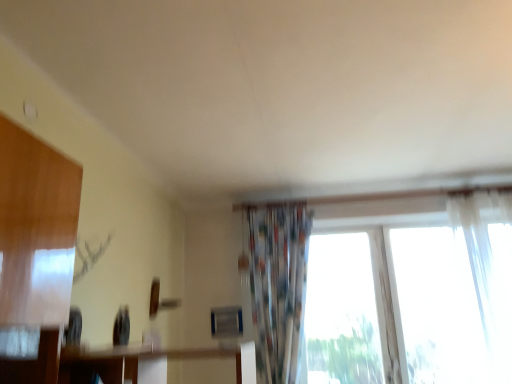
Question: Can we say white sheer curtain at right, which is the second curtain in left-to-right order, lies outside printed fabric curtain at center, which appears as the second curtain when viewed from the right?

Choices:
 (A) yes
 (B) no

Answer: (A)

Question: From the image's perspective, is white sheer curtain at right, which is the second curtain in left-to-right order, located beneath printed fabric curtain at center, which appears as the second curtain when viewed from the right?

Choices:
 (A) no
 (B) yes

Answer: (A)

Question: Is white sheer curtain at right, which is the second curtain in left-to-right order, surrounding printed fabric curtain at center, which appears as the first curtain when viewed from the left?

Choices:
 (A) yes
 (B) no

Answer: (B)

Question: Is white sheer curtain at right, which is the second curtain in left-to-right order, further to camera compared to printed fabric curtain at center, which appears as the second curtain when viewed from the right?

Choices:
 (A) no
 (B) yes

Answer: (A)

Question: From a real-world perspective, is white sheer curtain at right, which is the second curtain in left-to-right order, under printed fabric curtain at center, which appears as the first curtain when viewed from the left?

Choices:
 (A) yes
 (B) no

Answer: (A)

Question: Looking at their shapes, would you say printed fabric curtain at center, which appears as the first curtain when viewed from the left, is wider or thinner than transparent fabric at right?

Choices:
 (A) wide
 (B) thin

Answer: (A)

Question: Considering the relative positions of printed fabric curtain at center, which appears as the second curtain when viewed from the right, and transparent fabric at right in the image provided, is printed fabric curtain at center, which appears as the second curtain when viewed from the right, to the left or to the right of transparent fabric at right?

Choices:
 (A) left
 (B) right

Answer: (A)

Question: From their relative heights in the image, would you say printed fabric curtain at center, which appears as the first curtain when viewed from the left, is taller or shorter than transparent fabric at right?

Choices:
 (A) tall
 (B) short

Answer: (A)

Question: Relative to transparent fabric at right, is printed fabric curtain at center, which appears as the second curtain when viewed from the right, in front or behind?

Choices:
 (A) behind
 (B) front

Answer: (B)

Question: Is printed fabric curtain at center, which appears as the second curtain when viewed from the right, wider or thinner than white sheer curtain at right, placed as the first curtain when sorted from right to left?

Choices:
 (A) thin
 (B) wide

Answer: (B)

Question: Is point (272, 251) closer or farther from the camera than point (501, 375)?

Choices:
 (A) farther
 (B) closer

Answer: (A)

Question: In terms of height, does printed fabric curtain at center, which appears as the first curtain when viewed from the left, look taller or shorter compared to white sheer curtain at right, which is the second curtain in left-to-right order?

Choices:
 (A) short
 (B) tall

Answer: (A)

Question: Based on their positions, is printed fabric curtain at center, which appears as the first curtain when viewed from the left, located to the left or right of white sheer curtain at right, which is the second curtain in left-to-right order?

Choices:
 (A) left
 (B) right

Answer: (A)

Question: Is transparent fabric at right wider or thinner than white sheer curtain at right, which is the second curtain in left-to-right order?

Choices:
 (A) thin
 (B) wide

Answer: (A)

Question: Looking at the image, does transparent fabric at right seem bigger or smaller compared to white sheer curtain at right, placed as the first curtain when sorted from right to left?

Choices:
 (A) big
 (B) small

Answer: (B)